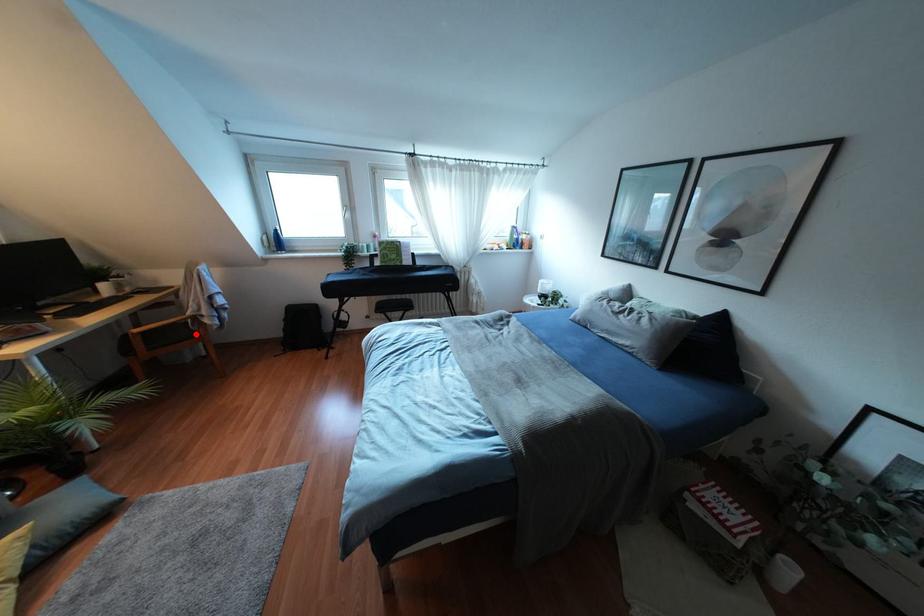
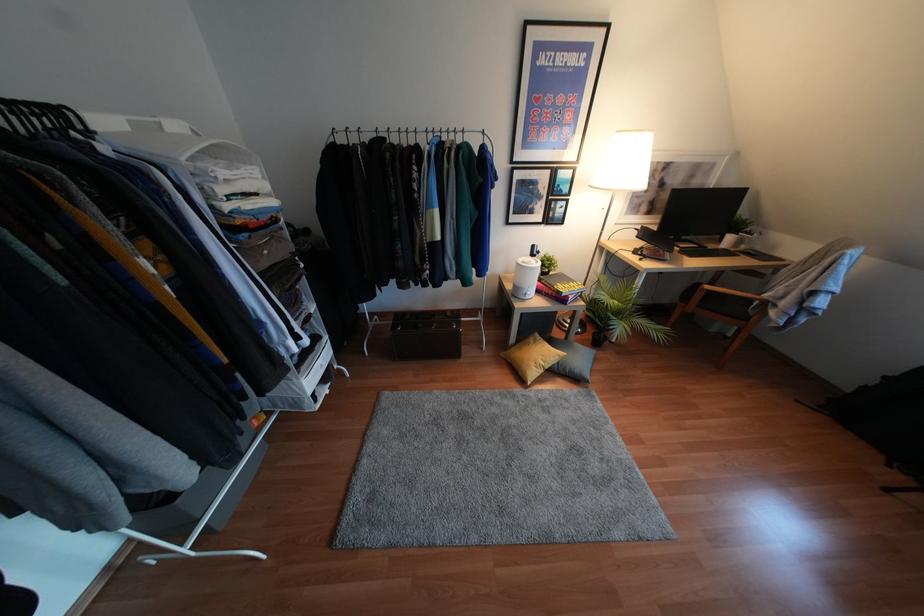
The point at the highlighted location is marked in the first image. Where is the corresponding point in the second image?

(745, 318)